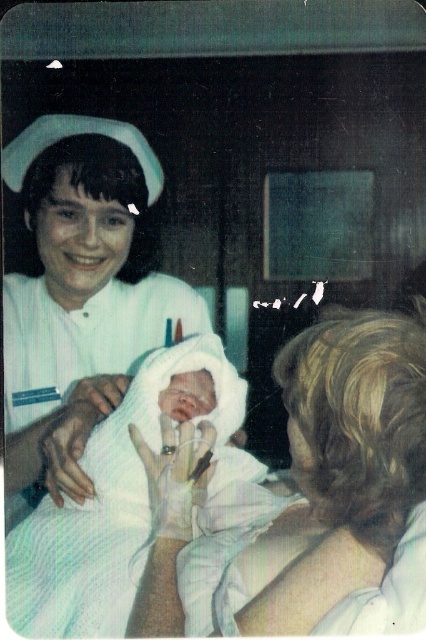
Question: Can you confirm if smooth white towel at center is positioned to the right of white smooth nurse cap at upper left?

Choices:
 (A) yes
 (B) no

Answer: (A)

Question: Can you confirm if smooth white towel at center is wider than white smooth nurse cap at upper left?

Choices:
 (A) no
 (B) yes

Answer: (B)

Question: From the image, what is the correct spatial relationship of smooth white towel at center in relation to white smooth nurse cap at upper left?

Choices:
 (A) right
 (B) left

Answer: (A)